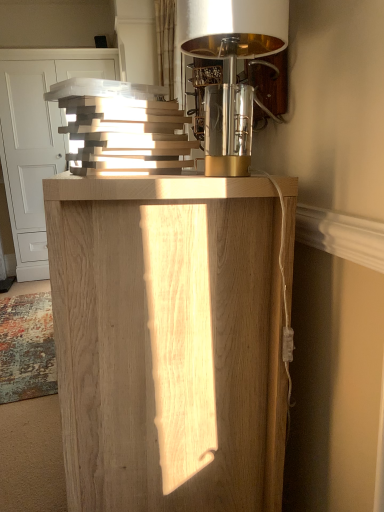
At what (x,y) coordinates should I click in order to perform the action: click on natural wood cabinet at upper left. Please return your answer as a coordinate pair (x, y). This screenshot has height=512, width=384. Looking at the image, I should click on (38, 138).

At what (x,y) coordinates should I click in order to perform the action: click on natural wood cabinet at upper left. Please return your answer as a coordinate pair (x, y). Looking at the image, I should click on (38, 138).

Can you see natural wood cabinet at center touching polished brass lampshade at upper right?

No, natural wood cabinet at center is not next to polished brass lampshade at upper right.

At what (x,y) coordinates should I click in order to perform the action: click on furniture below the polished brass lampshade at upper right (from the image's perspective). Please return your answer as a coordinate pair (x, y). Looking at the image, I should click on (168, 342).

Is natural wood cabinet at center oriented towards polished brass lampshade at upper right?

No, natural wood cabinet at center is not turned towards polished brass lampshade at upper right.

From the image's perspective, would you say polished brass lampshade at upper right is shown under natural wood cabinet at upper left?

Yes.

From a real-world perspective, which object rests below the other?

In real-world perspective, natural wood cabinet at upper left is lower.

Is point (202, 50) closer to viewer compared to point (19, 94)?

Yes.

Could you tell me if polished brass lampshade at upper right is turned towards natural wood cabinet at upper left?

No, polished brass lampshade at upper right is not facing towards natural wood cabinet at upper left.

Which of these two, natural wood cabinet at upper left or polished brass lampshade at upper right, stands shorter?

polished brass lampshade at upper right.

Looking at their sizes, would you say natural wood cabinet at upper left is wider or thinner than polished brass lampshade at upper right?

In the image, natural wood cabinet at upper left appears to be wider than polished brass lampshade at upper right.

From a real-world perspective, which is physically below, natural wood cabinet at upper left or polished brass lampshade at upper right?

From a 3D spatial view, natural wood cabinet at upper left is below.

The width and height of the screenshot is (384, 512). I want to click on table lamp behind the natural wood cabinet at center, so [x=231, y=70].

Does polished brass lampshade at upper right appear on the left side of natural wood cabinet at center?

Incorrect, polished brass lampshade at upper right is not on the left side of natural wood cabinet at center.

Is polished brass lampshade at upper right far away from natural wood cabinet at center?

They are positioned close to each other.

From the image's perspective, is polished brass lampshade at upper right beneath natural wood cabinet at center?

Incorrect, from the image's perspective, polished brass lampshade at upper right is higher than natural wood cabinet at center.

From a real-world perspective, is natural wood cabinet at center physically above natural wood cabinet at upper left?

No, from a real-world perspective, natural wood cabinet at center is not over natural wood cabinet at upper left

From the image's perspective, is natural wood cabinet at center below natural wood cabinet at upper left?

Yes, from the image's perspective, natural wood cabinet at center is below natural wood cabinet at upper left.

Which object is wider, natural wood cabinet at center or natural wood cabinet at upper left?

natural wood cabinet at upper left is wider.

Which object is closer to the camera taking this photo, natural wood cabinet at center or natural wood cabinet at upper left?

Positioned in front is natural wood cabinet at center.

How much distance is there between natural wood cabinet at upper left and natural wood cabinet at center?

natural wood cabinet at upper left is 12.56 feet away from natural wood cabinet at center.

From a real-world perspective, is natural wood cabinet at upper left above or below natural wood cabinet at center?

natural wood cabinet at upper left is situated higher than natural wood cabinet at center in the real world.

Is natural wood cabinet at center located within natural wood cabinet at upper left?

Definitely not — natural wood cabinet at center is not inside natural wood cabinet at upper left.

Based on the photo, considering the relative positions of natural wood cabinet at upper left and natural wood cabinet at center in the image provided, is natural wood cabinet at upper left behind natural wood cabinet at center?

Yes, it is.

This screenshot has height=512, width=384. I want to click on furniture that appears below the polished brass lampshade at upper right (from the image's perspective), so click(x=168, y=342).

The height and width of the screenshot is (512, 384). What are the coordinates of `cabinetry that is under the polished brass lampshade at upper right (from a real-world perspective)` in the screenshot? It's located at (38, 138).

Based on their spatial positions, is natural wood cabinet at upper left or natural wood cabinet at center further from polished brass lampshade at upper right?

natural wood cabinet at upper left lies further to polished brass lampshade at upper right than the other object.

Looking at the image, which one is located closer to natural wood cabinet at center, polished brass lampshade at upper right or natural wood cabinet at upper left?

The object closer to natural wood cabinet at center is polished brass lampshade at upper right.

Which object lies nearer to the anchor point natural wood cabinet at center, natural wood cabinet at upper left or polished brass lampshade at upper right?

polished brass lampshade at upper right is closer to natural wood cabinet at center.

From the picture: When comparing their distances from natural wood cabinet at upper left, does natural wood cabinet at center or polished brass lampshade at upper right seem further?

natural wood cabinet at center is positioned further to the anchor natural wood cabinet at upper left.

From the image, which object appears to be nearer to polished brass lampshade at upper right, natural wood cabinet at center or natural wood cabinet at upper left?

Based on the image, natural wood cabinet at center appears to be nearer to polished brass lampshade at upper right.

Estimate the real-world distances between objects in this image. Which object is further from natural wood cabinet at upper left, polished brass lampshade at upper right or natural wood cabinet at center?

Based on the image, natural wood cabinet at center appears to be further to natural wood cabinet at upper left.

Identify the location of table lamp between natural wood cabinet at center and natural wood cabinet at upper left in the front-back direction. (231, 70).